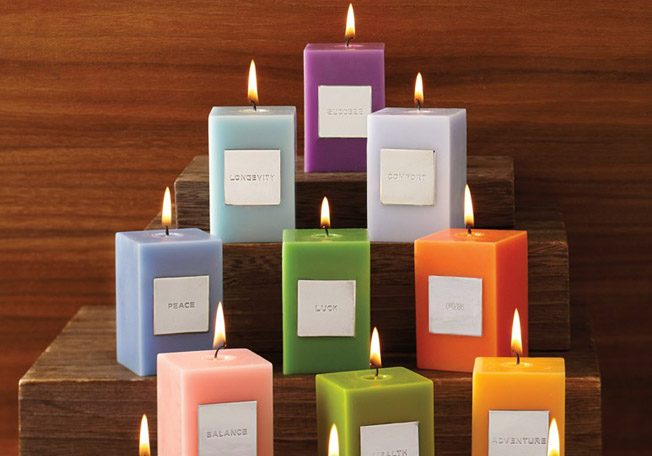
I want to click on candles, so click(231, 403), click(173, 286), click(254, 184), click(336, 99), click(420, 158), click(336, 286), click(466, 284), click(394, 417), click(534, 408).